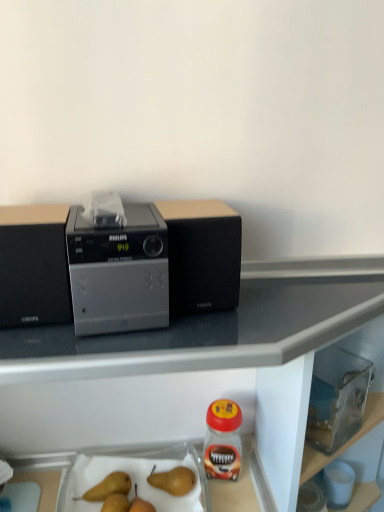
Question: In which direction should I rotate to look at smooth brown pears at lower center, the 2th fruit when ordered from left to right?

Choices:
 (A) left
 (B) right

Answer: (A)

Question: Does smooth brown pear at lower left, the first fruit from the left, have a larger size compared to clear glass jar at lower right?

Choices:
 (A) no
 (B) yes

Answer: (A)

Question: Could you tell me if smooth brown pear at lower left, acting as the third fruit starting from the right, is turned towards clear glass jar at lower right?

Choices:
 (A) no
 (B) yes

Answer: (A)

Question: From a real-world perspective, is smooth brown pear at lower left, acting as the third fruit starting from the right, below clear glass jar at lower right?

Choices:
 (A) yes
 (B) no

Answer: (A)

Question: Are smooth brown pear at lower left, acting as the third fruit starting from the right, and clear glass jar at lower right far apart?

Choices:
 (A) yes
 (B) no

Answer: (B)

Question: Is smooth brown pear at lower left, acting as the third fruit starting from the right, at the left side of clear glass jar at lower right?

Choices:
 (A) yes
 (B) no

Answer: (A)

Question: From a real-world perspective, is smooth brown pear at lower left, acting as the third fruit starting from the right, over clear glass jar at lower right?

Choices:
 (A) yes
 (B) no

Answer: (B)

Question: Is satin silver radio at center thinner than smooth brown pear at lower left, acting as the third fruit starting from the right?

Choices:
 (A) yes
 (B) no

Answer: (B)

Question: From a real-world perspective, is satin silver radio at center positioned over smooth brown pear at lower left, the first fruit from the left, based on gravity?

Choices:
 (A) yes
 (B) no

Answer: (A)

Question: Could you tell me if satin silver radio at center is turned towards smooth brown pear at lower left, the first fruit from the left?

Choices:
 (A) no
 (B) yes

Answer: (A)

Question: Does satin silver radio at center appear on the left side of smooth brown pear at lower left, acting as the third fruit starting from the right?

Choices:
 (A) yes
 (B) no

Answer: (B)

Question: Is smooth brown pear at lower left, acting as the third fruit starting from the right, surrounded by satin silver radio at center?

Choices:
 (A) yes
 (B) no

Answer: (B)

Question: From the image's perspective, is satin silver radio at center located above smooth brown pear at lower left, the first fruit from the left?

Choices:
 (A) yes
 (B) no

Answer: (A)

Question: Is satin silver radio at center looking in the opposite direction of transparent plastic container at lower right?

Choices:
 (A) yes
 (B) no

Answer: (B)